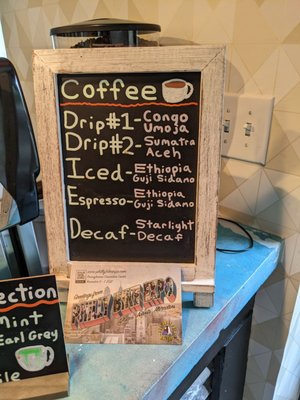
Identify the location of mocha colored tile. This screenshot has width=300, height=400. (286, 162).